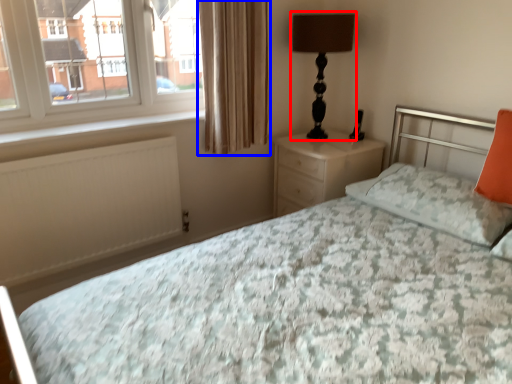
Question: Which object is further to the camera taking this photo, table lamp (highlighted by a red box) or curtain (highlighted by a blue box)?

Choices:
 (A) table lamp
 (B) curtain

Answer: (A)